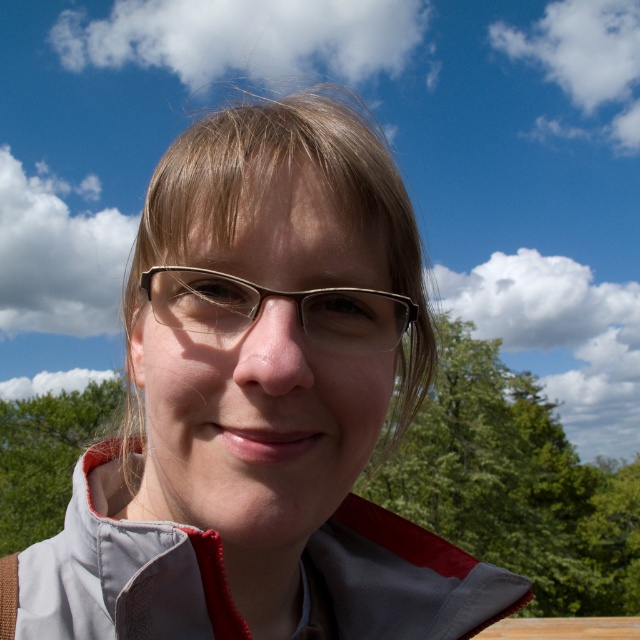
Question: Based on their relative distances, which object is nearer to the matte gray jacket at center?

Choices:
 (A) green leafy tree at lower left
 (B) metallic gold glasses at center
 (C) green leafy tree at center
 (D) cloudy sky at upper left

Answer: (B)

Question: Can you confirm if cloudy sky at upper left is smaller than white fluffy cloud at upper right?

Choices:
 (A) yes
 (B) no

Answer: (B)

Question: Which is nearer to the green leafy tree at center?

Choices:
 (A) white fluffy cloud at upper center
 (B) metallic gold glasses at center
 (C) white fluffy cloud at upper right
 (D) green leafy tree at lower left

Answer: (D)

Question: From the image, what is the correct spatial relationship of white fluffy cloud at upper center in relation to cloudy sky at upper left?

Choices:
 (A) right
 (B) left

Answer: (A)

Question: Which is nearer to the cloudy sky at upper left?

Choices:
 (A) white fluffy cloud at upper center
 (B) metallic gold glasses at center

Answer: (A)

Question: Does green leafy tree at center have a smaller size compared to cloudy sky at upper left?

Choices:
 (A) yes
 (B) no

Answer: (A)